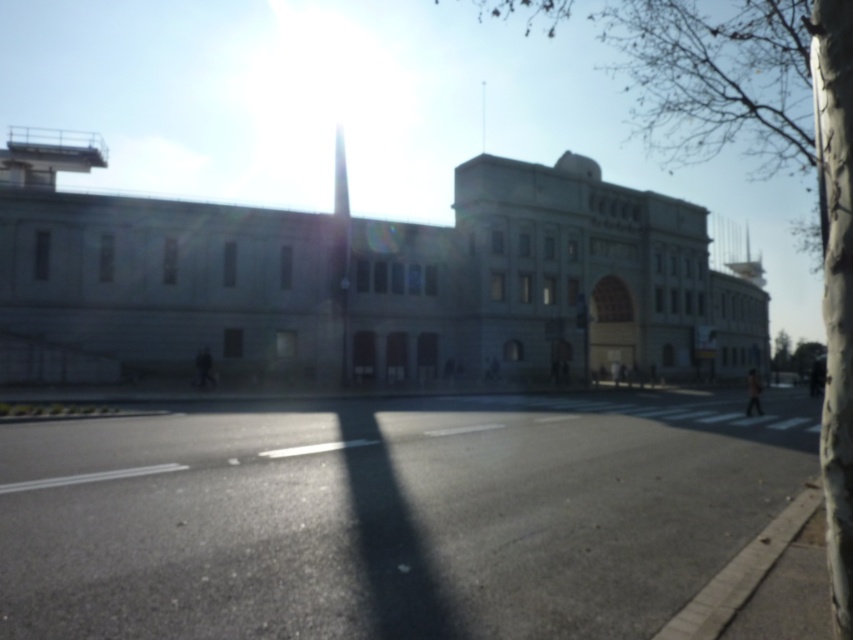
You are a photographer trying to capture the entire view of the bare bark tree at upper right and the green leafy tree at right in a single shot. Given their sizes, will you need to adjust your camera angle to include both?

The bare bark tree at upper right is much taller than the green leafy tree at right, so you will need to adjust your camera angle to capture the entire view of both trees in a single shot.

You are a photographer trying to capture the entire scene in a single shot. Given that the bare bark tree at upper right and the green leafy tree at right are both in your frame, which tree would require you to adjust your camera angle more to avoid cropping?

The bare bark tree at upper right would require adjusting the camera angle more because its width surpasses that of the green leafy tree at right, making it harder to fit within the frame without cropping.